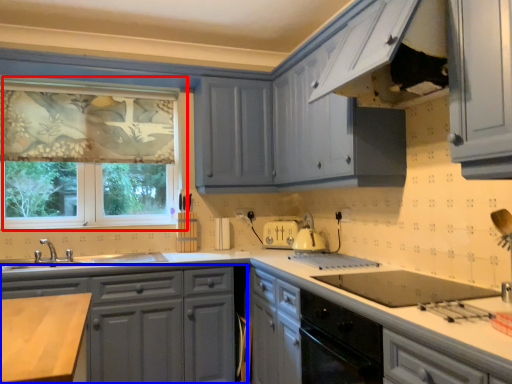
Question: Among these objects, which one is nearest to the camera, window (highlighted by a red box) or cabinetry (highlighted by a blue box)?

Choices:
 (A) window
 (B) cabinetry

Answer: (B)